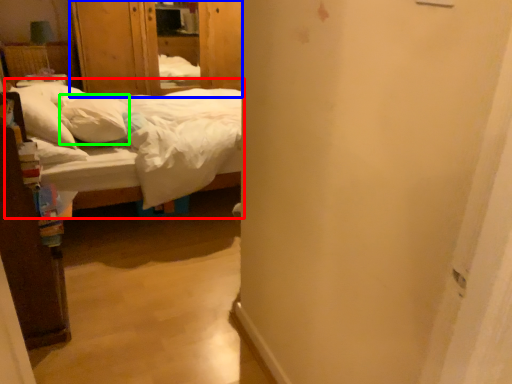
Question: Which object is the closest to the bed (highlighted by a red box)? Choose among these: armoire (highlighted by a blue box) or pillow (highlighted by a green box).

Choices:
 (A) armoire
 (B) pillow

Answer: (B)